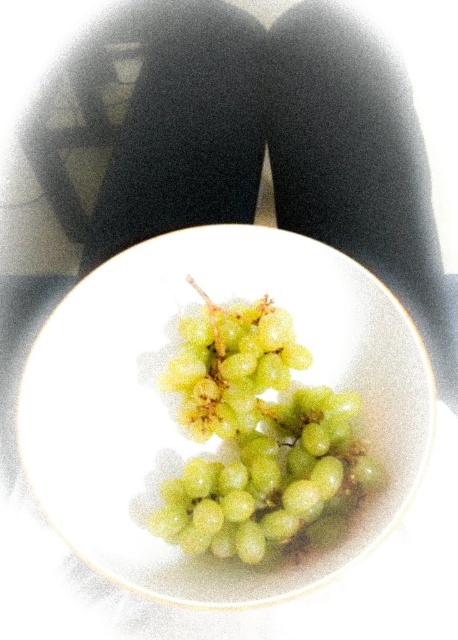
Question: Which object appears closest to the camera in this image?

Choices:
 (A) green matte grapes at center
 (B) white glossy platter at center

Answer: (B)

Question: Does white glossy platter at center have a larger size compared to green matte grapes at center?

Choices:
 (A) yes
 (B) no

Answer: (A)

Question: Does white glossy platter at center have a lesser width compared to green matte grapes at center?

Choices:
 (A) yes
 (B) no

Answer: (B)

Question: Does white glossy platter at center lie behind green matte grapes at center?

Choices:
 (A) no
 (B) yes

Answer: (A)